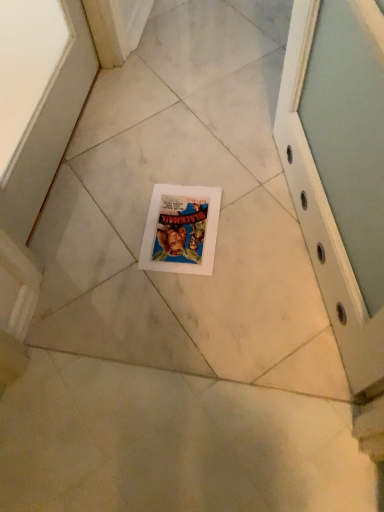
Find the location of `vacant region in front of white paper comic book at center`. vacant region in front of white paper comic book at center is located at coordinates (190, 304).